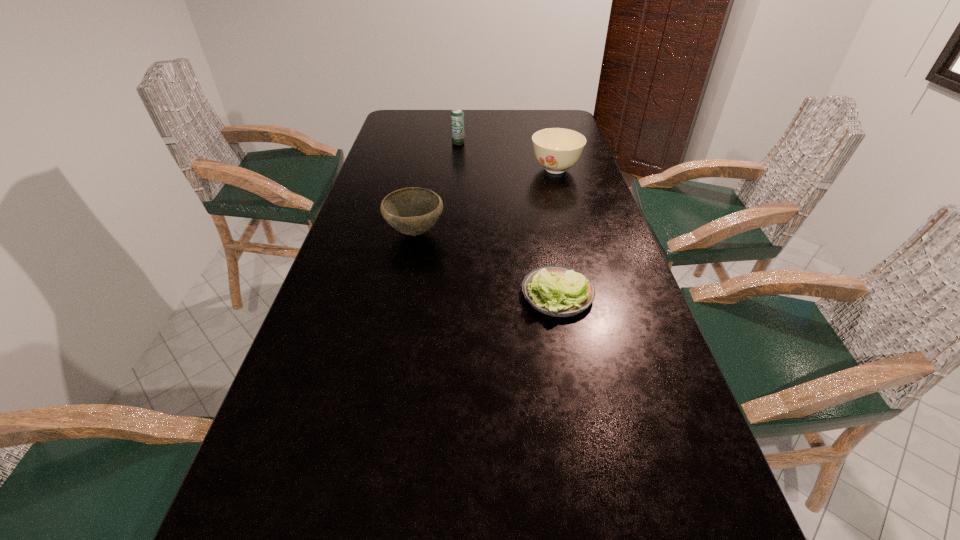
In order to click on sugar bowl that is at the right edge in this screenshot , I will do `click(556, 149)`.

Locate an element on the screen. lettuce at the right edge is located at coordinates (558, 291).

This screenshot has height=540, width=960. In the image, there is a desktop. Identify the location of vacant space at the far edge. (514, 120).

In the image, there is a desktop. At what (x,y) coordinates should I click in order to perform the action: click on vacant space at the left edge. Please return your answer as a coordinate pair (x, y). This screenshot has height=540, width=960. Looking at the image, I should click on (393, 185).

Locate an element on the screen. free space at the right edge of the desktop is located at coordinates (567, 196).

What are the coordinates of `vacant space at the far left corner of the desktop` in the screenshot? It's located at (397, 114).

In order to click on free area in between the sugar bowl and the nearest object in this screenshot , I will do `click(557, 232)`.

I want to click on empty space between the nearest object and the bowl, so [x=487, y=264].

The width and height of the screenshot is (960, 540). I want to click on free space between the beer can and the bowl, so click(437, 187).

You are a GUI agent. You are given a task and a screenshot of the screen. Output one action in this format:
    pyautogui.click(x=<x>, y=<y>)
    Task: Click on the free spot between the beer can and the second nearest object
    
    Given the screenshot: What is the action you would take?
    pyautogui.click(x=437, y=187)